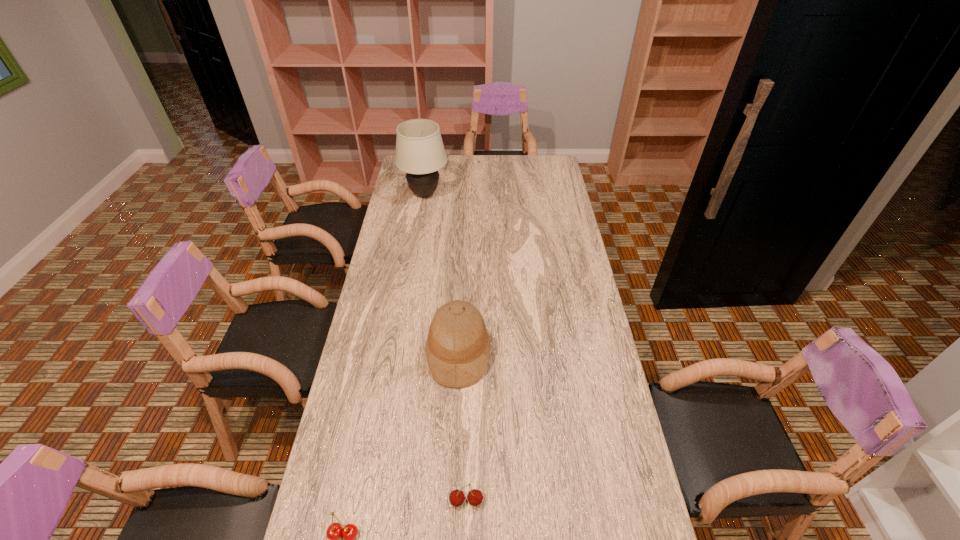
The width and height of the screenshot is (960, 540). Find the location of `free space at the far edge of the desktop`. free space at the far edge of the desktop is located at coordinates (463, 168).

At what (x,y) coordinates should I click in order to perform the action: click on blank space at the left edge. Please return your answer as a coordinate pair (x, y). The image size is (960, 540). Looking at the image, I should click on (398, 252).

You are a GUI agent. You are given a task and a screenshot of the screen. Output one action in this format:
    pyautogui.click(x=<x>, y=<y>)
    Task: Click on the vacant area at the right edge of the desktop
    The height and width of the screenshot is (540, 960).
    Given the screenshot: What is the action you would take?
    pyautogui.click(x=560, y=192)

Image resolution: width=960 pixels, height=540 pixels. In the image, there is a desktop. Find the location of `vacant space at the far right corner`. vacant space at the far right corner is located at coordinates (531, 168).

At what (x,y) coordinates should I click in order to perform the action: click on free space between the tallest object and the second farthest object. Please return your answer as a coordinate pair (x, y). The width and height of the screenshot is (960, 540). Looking at the image, I should click on (442, 274).

Where is `vacant area that lies between the tallest object and the third nearest object`? Image resolution: width=960 pixels, height=540 pixels. vacant area that lies between the tallest object and the third nearest object is located at coordinates (442, 274).

Find the location of a particular element. The height and width of the screenshot is (540, 960). free space between the second tallest object and the third farthest object is located at coordinates (463, 427).

What are the coordinates of `vacant area between the hat and the third farthest object` in the screenshot? It's located at (463, 427).

At what (x,y) coordinates should I click in order to perform the action: click on free point between the farther cherry and the second tallest object. Please return your answer as a coordinate pair (x, y). This screenshot has width=960, height=540. Looking at the image, I should click on (463, 427).

Where is `object that is the second nearest to the second tallest object`? The width and height of the screenshot is (960, 540). object that is the second nearest to the second tallest object is located at coordinates (349, 532).